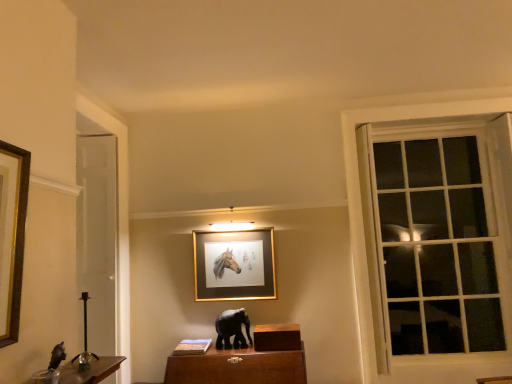
At what (x,y) coordinates should I click in order to perform the action: click on vacant area on top of gold/metallic picture frame at center (from a real-world perspective). Please return your answer as a coordinate pair (x, y). Looking at the image, I should click on (229, 228).